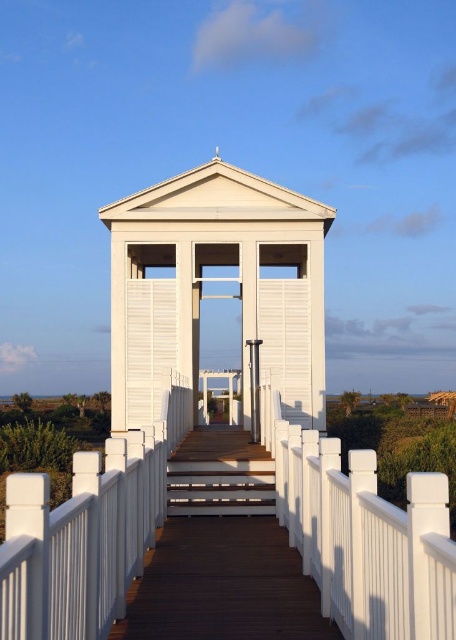
Question: Among these objects, which one is farthest from the camera?

Choices:
 (A) brown wooden stairs at center
 (B) white matte gazebo at center

Answer: (B)

Question: Can you confirm if white matte gazebo at center is bigger than brown wooden stairs at center?

Choices:
 (A) yes
 (B) no

Answer: (A)

Question: Among these objects, which one is farthest from the camera?

Choices:
 (A) white matte gazebo at center
 (B) wooden deck at center
 (C) brown wooden stairs at center

Answer: (A)

Question: Does white matte gazebo at center appear on the left side of wooden deck at center?

Choices:
 (A) yes
 (B) no

Answer: (A)

Question: Which object is farther from the camera taking this photo?

Choices:
 (A) white matte gazebo at center
 (B) wooden deck at center

Answer: (A)

Question: Is white matte gazebo at center positioned at the back of brown wooden stairs at center?

Choices:
 (A) no
 (B) yes

Answer: (B)